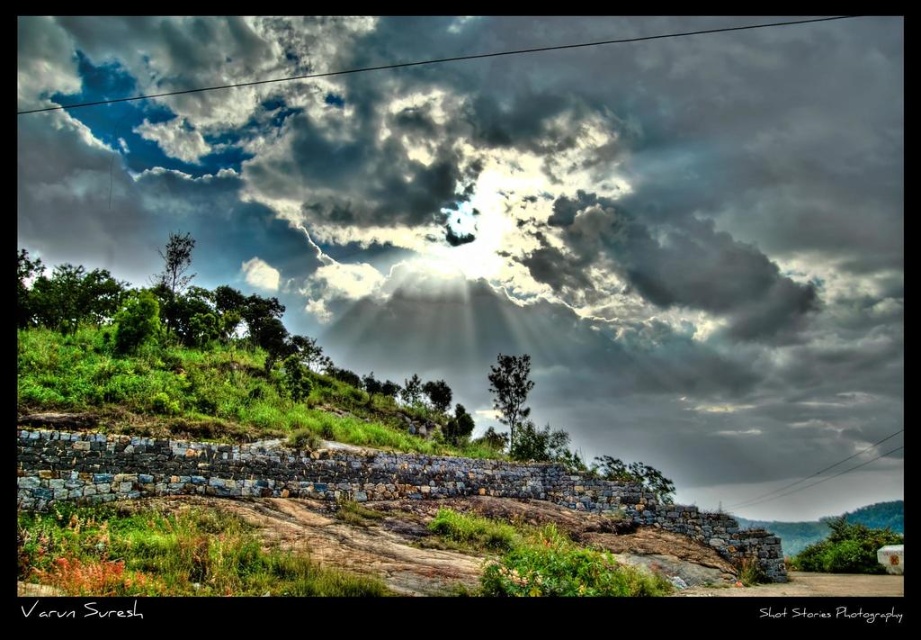
Between cloudy sky at upper center and dark green leafy tree at center, which one is positioned lower?

dark green leafy tree at center is lower down.

Which of these two, cloudy sky at upper center or dark green leafy tree at center, stands taller?

cloudy sky at upper center

Measure the distance between point [779,346] and camera.

A distance of 183.11 meters exists between point [779,346] and camera.

Where is `cloudy sky at upper center`? cloudy sky at upper center is located at coordinates (520, 211).

Is cloudy sky at upper center in front of green leafy tree at lower right?

No.

Looking at this image, how distant is cloudy sky at upper center from green leafy tree at lower right?

cloudy sky at upper center and green leafy tree at lower right are 93.99 meters apart from each other.

Is point (391, 314) less distant than point (826, 570)?

No, (391, 314) is behind (826, 570).

You are a GUI agent. You are given a task and a screenshot of the screen. Output one action in this format:
    pyautogui.click(x=<x>, y=<y>)
    Task: Click on the cloudy sky at upper center
    
    Given the screenshot: What is the action you would take?
    pyautogui.click(x=520, y=211)

Can you confirm if green leafy tree at lower right is taller than dark green leafy tree at center?

Indeed, green leafy tree at lower right has a greater height compared to dark green leafy tree at center.

Identify the location of green leafy tree at lower right. (845, 547).

Image resolution: width=921 pixels, height=640 pixels. I want to click on green leafy tree at lower right, so click(845, 547).